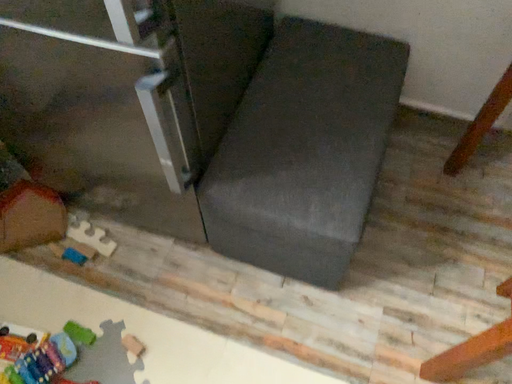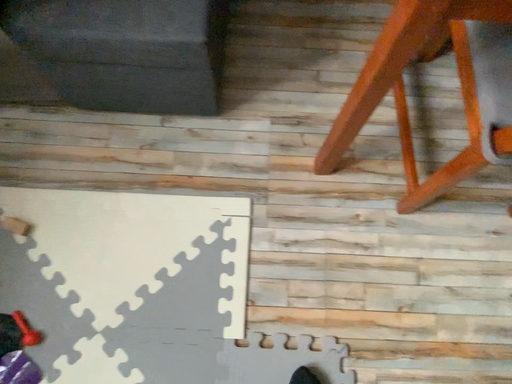
Question: How did the camera likely rotate when shooting the video?

Choices:
 (A) rotated upward
 (B) rotated downward

Answer: (B)